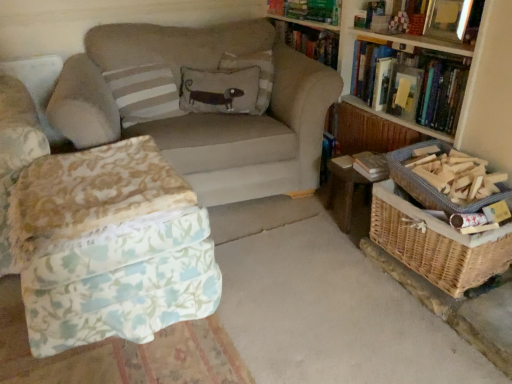
Image resolution: width=512 pixels, height=384 pixels. I want to click on vacant area that is situated to the right of floral fabric ottoman at lower left, so click(x=272, y=297).